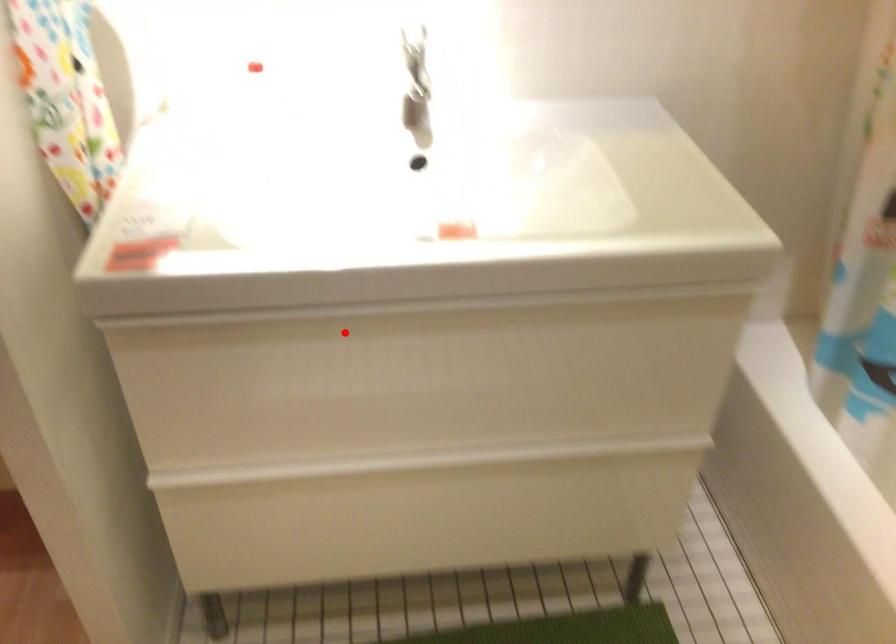
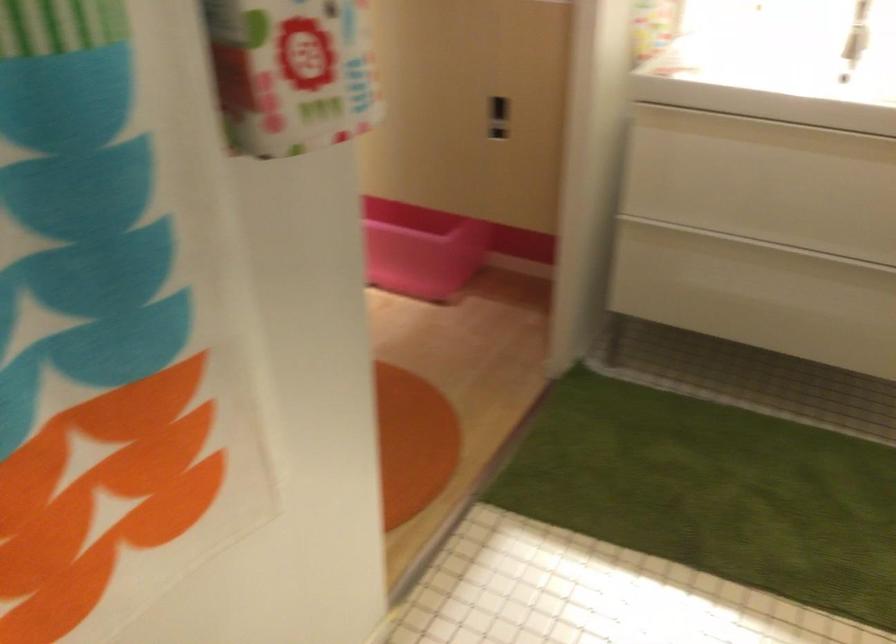
Question: I am providing you with two images of the same scene from different viewpoints. Given a red point in image1, look at the same physical point in image2. Is it:

Choices:
 (A) Closer to the viewpoint
 (B) Farther from the viewpoint

Answer: (B)